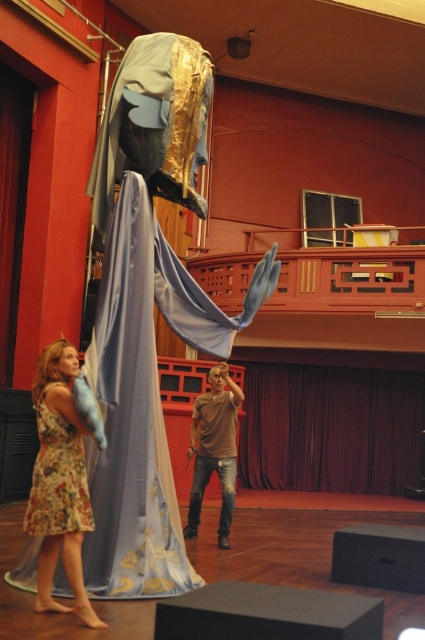
Question: Which object is closer to the camera taking this photo?

Choices:
 (A) brown cotton shirt at center
 (B) floral fabric dress at lower left

Answer: (B)

Question: Which point appears farthest from the camera in this image?

Choices:
 (A) (42, 518)
 (B) (200, 444)

Answer: (B)

Question: From the image, what is the correct spatial relationship of floral fabric dress at lower left in relation to brown cotton shirt at center?

Choices:
 (A) below
 (B) above

Answer: (B)

Question: Is velvet dark red curtain at center above floral fabric dress at lower left?

Choices:
 (A) yes
 (B) no

Answer: (B)

Question: Is velvet dark red curtain at center in front of floral fabric dress at lower left?

Choices:
 (A) yes
 (B) no

Answer: (B)

Question: Among these objects, which one is farthest from the camera?

Choices:
 (A) velvet dark red curtain at center
 (B) brown cotton shirt at center
 (C) floral dress at lower left

Answer: (A)